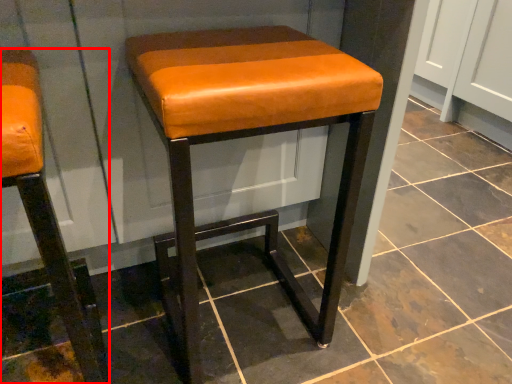
Question: From the image's perspective, where is stool (annotated by the red box) located in relation to stool in the image?

Choices:
 (A) below
 (B) above

Answer: (A)